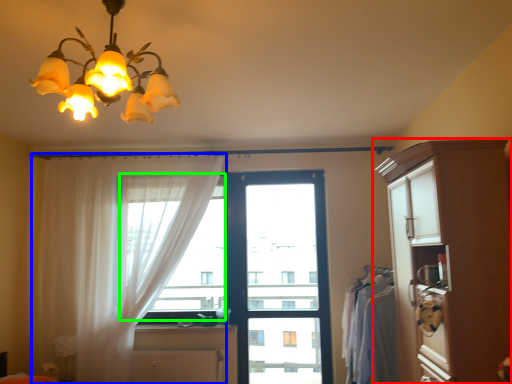
Question: Based on their relative distances, which object is nearer to cabinetry (highlighted by a red box)? Choose from curtain (highlighted by a blue box) and window screen (highlighted by a green box).

Choices:
 (A) curtain
 (B) window screen

Answer: (B)